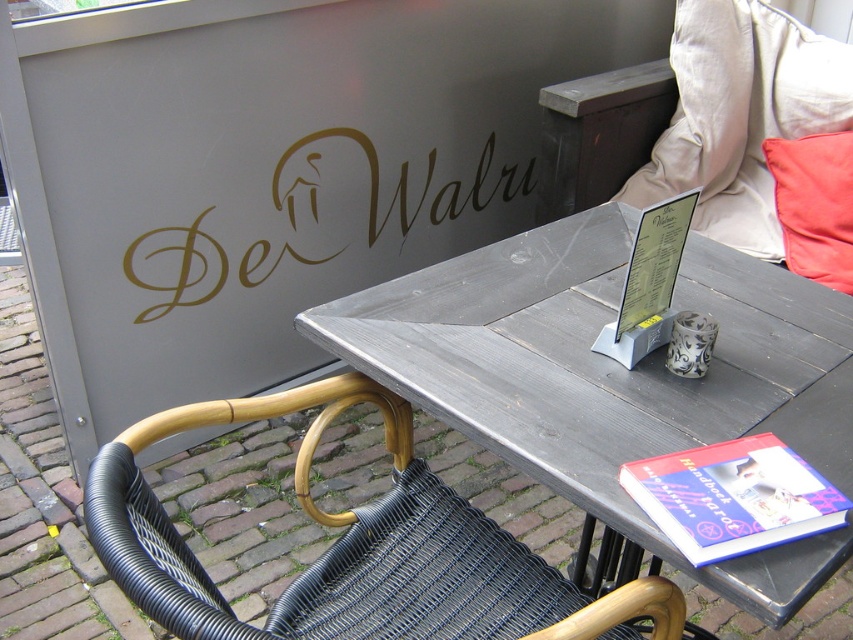
Does dark gray wood table at center appear over black wicker chair at lower left?

Yes, dark gray wood table at center is above black wicker chair at lower left.

Who is lower down, dark gray wood table at center or black wicker chair at lower left?

black wicker chair at lower left is below.

Between point (527, 333) and point (537, 556), which one is positioned in front?

Point (527, 333)

Identify the location of dark gray wood table at center. The image size is (853, 640). (614, 376).

Is gold metallic sign at upper center positioned before red fabric pillow at upper right?

Yes, gold metallic sign at upper center is in front of red fabric pillow at upper right.

Is gold metallic sign at upper center further to the viewer compared to red fabric pillow at upper right?

That is False.

I want to click on gold metallic sign at upper center, so click(314, 218).

The image size is (853, 640). Find the location of `gold metallic sign at upper center`. gold metallic sign at upper center is located at coordinates (314, 218).

Which is behind, point (119, 561) or point (775, 481)?

The point (775, 481) is more distant.

Is the position of black wicker chair at lower left less distant than that of blue hardcover book at lower right?

Yes, black wicker chair at lower left is in front of blue hardcover book at lower right.

Between point (285, 589) and point (753, 524), which one is positioned in front?

Point (753, 524) is more forward.

Where is `black wicker chair at lower left`? black wicker chair at lower left is located at coordinates (355, 548).